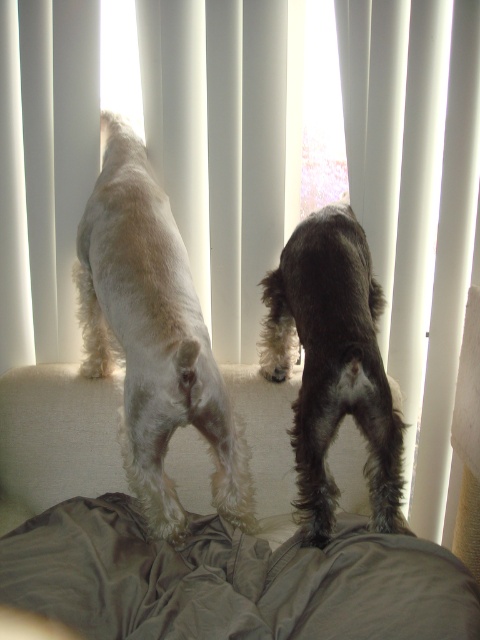
Which is more to the left, white fabric curtain at right or white fluffy dog at center?

white fluffy dog at center

Does white fabric curtain at right have a lesser width compared to white fluffy dog at center?

Yes, white fabric curtain at right is thinner than white fluffy dog at center.

Find the location of a particular element. white fabric curtain at right is located at coordinates coord(416,198).

Can you confirm if white fabric curtain at right is positioned to the left of shiny brown fur at center?

Incorrect, white fabric curtain at right is not on the left side of shiny brown fur at center.

Based on the photo, who is more forward, (441, 499) or (385, 524)?

Point (385, 524) is more forward.

Is point (382, 332) closer to viewer compared to point (284, 284)?

No.

At what (x,y) coordinates should I click in order to perform the action: click on white fabric curtain at right. Please return your answer as a coordinate pair (x, y). Looking at the image, I should click on (416, 198).

Who is taller, white fluffy dog at center or shiny brown fur at center?

white fluffy dog at center is taller.

This screenshot has height=640, width=480. What do you see at coordinates (153, 336) in the screenshot?
I see `white fluffy dog at center` at bounding box center [153, 336].

Does point (84, 372) come in front of point (264, 294)?

That is False.

Where is `white fluffy dog at center`? white fluffy dog at center is located at coordinates (153, 336).